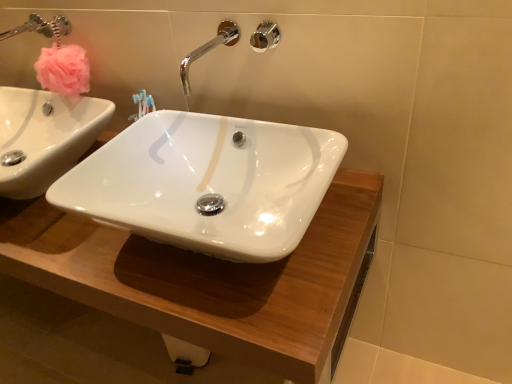
Question: Is chrome/metallic faucet at upper center directly adjacent to polished chrome shower at upper center?

Choices:
 (A) no
 (B) yes

Answer: (A)

Question: Considering the relative sizes of chrome/metallic faucet at upper center and polished chrome shower at upper center in the image provided, is chrome/metallic faucet at upper center shorter than polished chrome shower at upper center?

Choices:
 (A) no
 (B) yes

Answer: (A)

Question: Is chrome/metallic faucet at upper center to the right of polished chrome shower at upper center from the viewer's perspective?

Choices:
 (A) yes
 (B) no

Answer: (B)

Question: From the image's perspective, is chrome/metallic faucet at upper center beneath polished chrome shower at upper center?

Choices:
 (A) no
 (B) yes

Answer: (B)

Question: Is polished chrome shower at upper center inside chrome/metallic faucet at upper center?

Choices:
 (A) yes
 (B) no

Answer: (B)

Question: Is point (115, 248) closer or farther from the camera than point (217, 34)?

Choices:
 (A) farther
 (B) closer

Answer: (B)

Question: Is white glossy wood counter top at center spatially inside chrome/metallic faucet at upper center, or outside of it?

Choices:
 (A) inside
 (B) outside

Answer: (B)

Question: From the image's perspective, is white glossy wood counter top at center positioned above or below chrome/metallic faucet at upper center?

Choices:
 (A) above
 (B) below

Answer: (B)

Question: Considering the relative positions of white glossy wood counter top at center and chrome/metallic faucet at upper center in the image provided, is white glossy wood counter top at center to the left or to the right of chrome/metallic faucet at upper center?

Choices:
 (A) left
 (B) right

Answer: (A)

Question: In terms of height, does polished chrome shower at upper center look taller or shorter compared to chrome/metallic faucet at upper center?

Choices:
 (A) tall
 (B) short

Answer: (B)

Question: In terms of size, does polished chrome shower at upper center appear bigger or smaller than chrome/metallic faucet at upper center?

Choices:
 (A) small
 (B) big

Answer: (A)

Question: From a real-world perspective, is polished chrome shower at upper center positioned above or below chrome/metallic faucet at upper center?

Choices:
 (A) above
 (B) below

Answer: (A)

Question: From the image's perspective, is polished chrome shower at upper center positioned above or below chrome/metallic faucet at upper center?

Choices:
 (A) above
 (B) below

Answer: (A)

Question: In terms of width, does white glossy wood counter top at center look wider or thinner when compared to polished chrome shower at upper center?

Choices:
 (A) thin
 (B) wide

Answer: (B)

Question: Considering the positions of white glossy wood counter top at center and polished chrome shower at upper center in the image, is white glossy wood counter top at center bigger or smaller than polished chrome shower at upper center?

Choices:
 (A) small
 (B) big

Answer: (B)